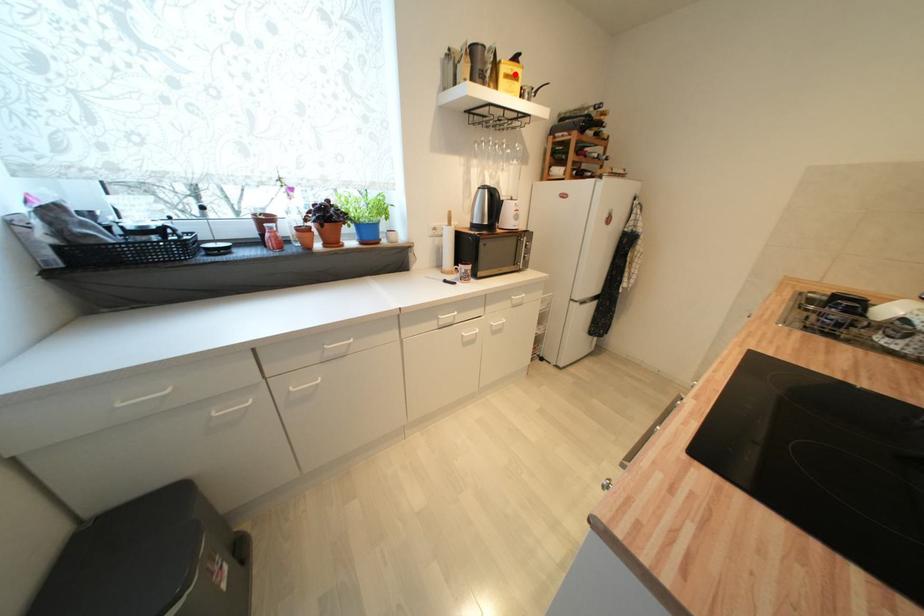
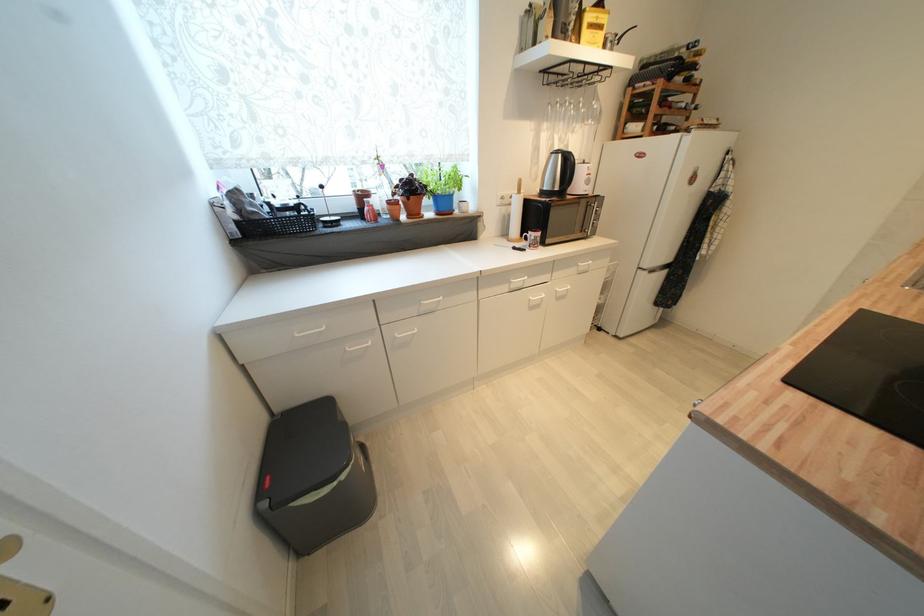
Question: I am providing you with two images of the same scene from different viewpoints. A red point is marked on the first image. Is the red point's position out of view in image 2?

Choices:
 (A) Yes
 (B) No

Answer: (B)